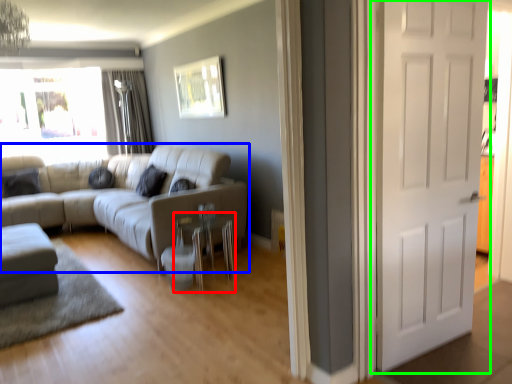
Question: Which object is positioned closest to side table (highlighted by a red box)? Select from studio couch (highlighted by a blue box) and door (highlighted by a green box).

Choices:
 (A) studio couch
 (B) door

Answer: (A)